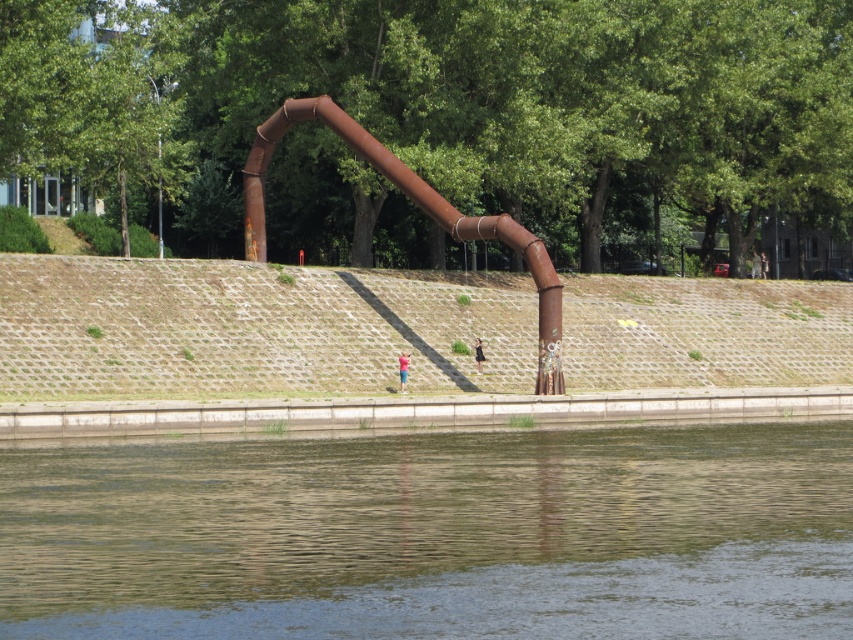
You are a photographer trying to capture a shot of the light blue shirt at center and the black fabric person at center. If you want to ensure both subjects are in focus, which one should you position closer to the camera to maintain depth of field?

The light blue shirt at center is shorter than the black fabric person at center, so positioning the shorter light blue shirt at center closer to the camera would help maintain depth of field by keeping both within the focal range.

You are a photographer trying to capture the brown water at lower center and the light blue shirt at center in the same frame. Which object is wider in the image?

The brown water at lower center is wider than the light blue shirt at center.